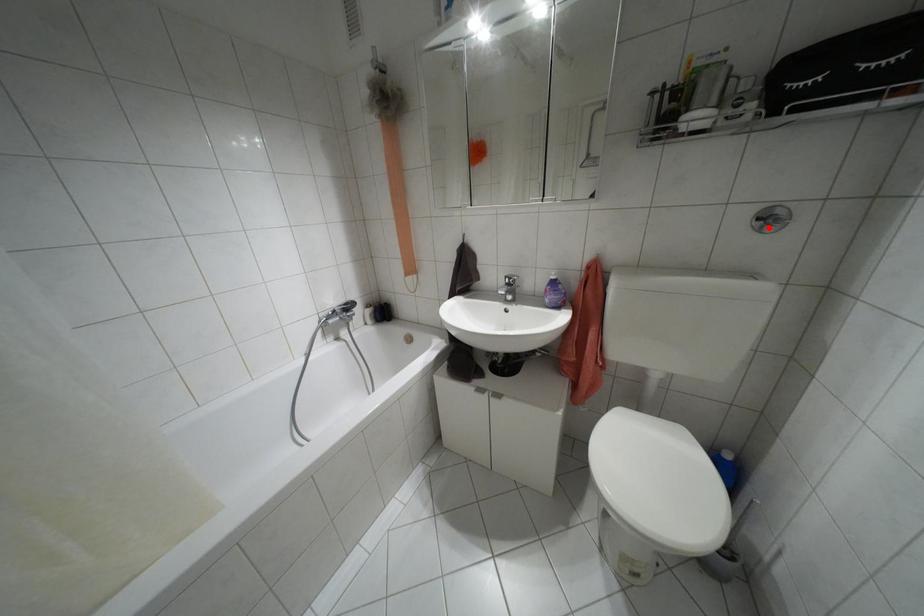
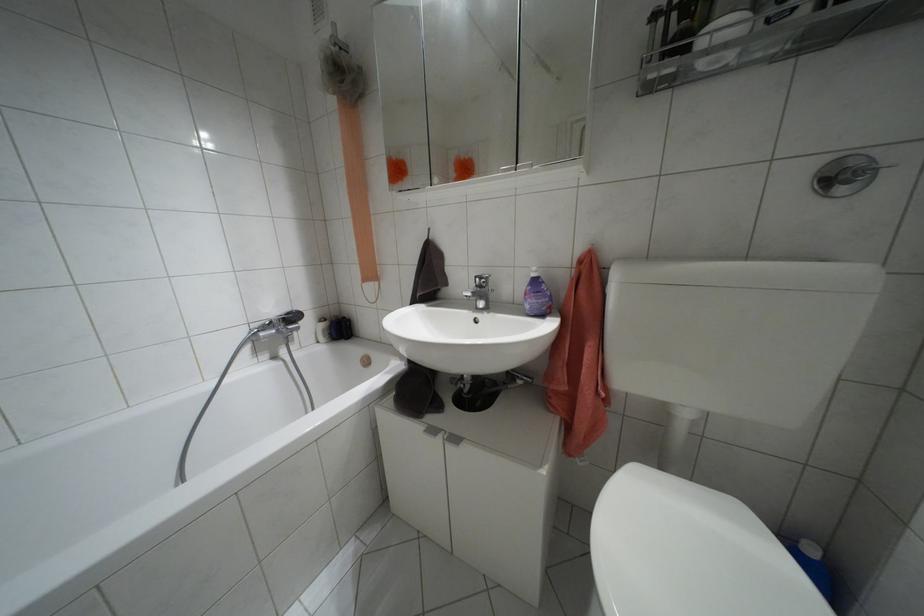
Find the pixel in the second image that matches the highlighted location in the first image.

(841, 190)